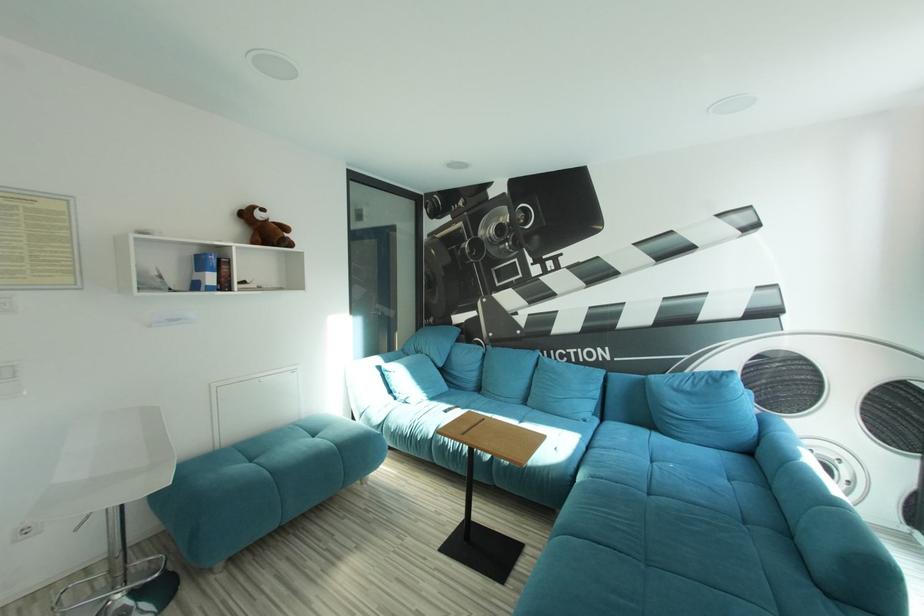
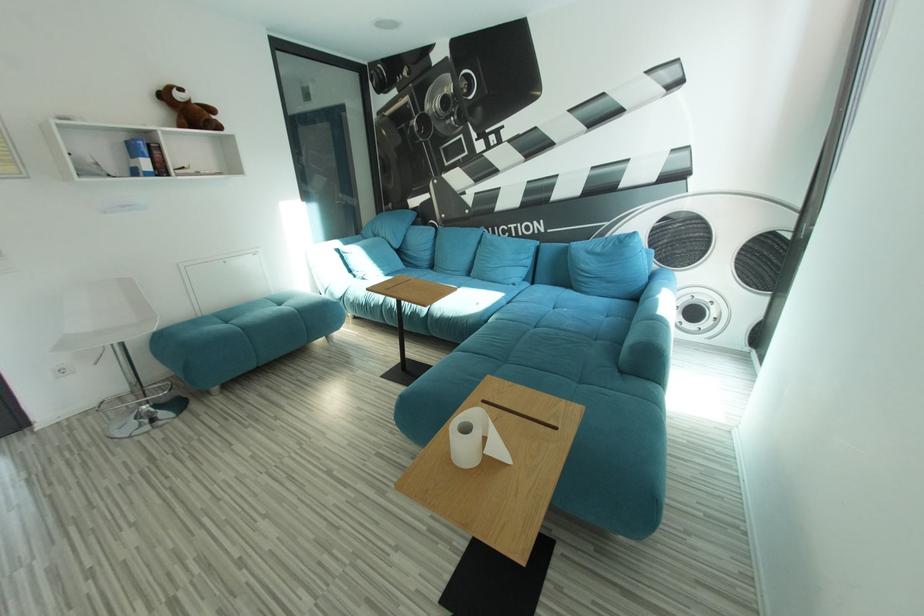
What movement of the cameraman would produce the second image?

The cameraman moved toward right, backward.